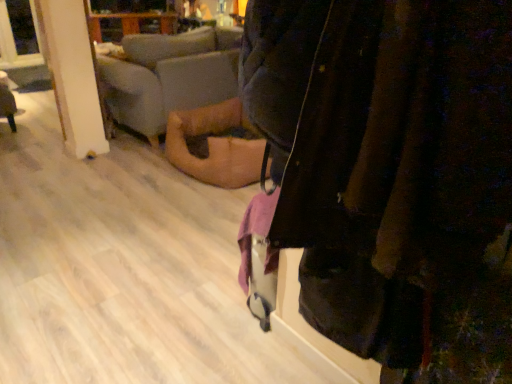
Describe the element at coordinates (169, 76) in the screenshot. I see `soft beige fabric couch at center` at that location.

Where is `velvet dark jacket at center`? Image resolution: width=512 pixels, height=384 pixels. velvet dark jacket at center is located at coordinates (393, 175).

Describe the element at coordinates (393, 175) in the screenshot. The height and width of the screenshot is (384, 512). I see `velvet dark jacket at center` at that location.

Locate an element on the screen. transparent glass window at upper left is located at coordinates (18, 32).

In the scene shown: Is transparent glass window at upper left facing towards soft beige fabric couch at center?

Yes.

Is point (21, 25) positioned before point (158, 61)?

No, it is not.

From a real-world perspective, is transparent glass window at upper left physically below soft beige fabric couch at center?

No, from a real-world perspective, transparent glass window at upper left is not below soft beige fabric couch at center.

From the image's perspective, which is above, transparent glass window at upper left or soft beige fabric couch at center?

From the image's view, transparent glass window at upper left is above.

Is transparent glass window at upper left taller than wooden floor at lower left?

Yes, transparent glass window at upper left is taller than wooden floor at lower left.

Can you tell me how much transparent glass window at upper left and wooden floor at lower left differ in facing direction?

The facing directions of transparent glass window at upper left and wooden floor at lower left are 87 degrees apart.

Which of these two, transparent glass window at upper left or wooden floor at lower left, is smaller?

With smaller size is wooden floor at lower left.

Which object is positioned more to the left, transparent glass window at upper left or wooden floor at lower left?

From the viewer's perspective, transparent glass window at upper left appears more on the left side.

The image size is (512, 384). I want to click on jacket above the wooden floor at lower left (from a real-world perspective), so click(x=393, y=175).

Measure the distance from wooden floor at lower left to velvet dark jacket at center.

wooden floor at lower left and velvet dark jacket at center are 13.56 feet apart from each other.

In terms of size, does wooden floor at lower left appear bigger or smaller than velvet dark jacket at center?

wooden floor at lower left is smaller than velvet dark jacket at center.

Which is correct: wooden floor at lower left is inside velvet dark jacket at center, or outside of it?

wooden floor at lower left is not inside velvet dark jacket at center, it's outside.

Is soft beige fabric couch at center spatially inside transparent glass window at upper left, or outside of it?

The correct answer is: outside.

Based on their sizes in the image, would you say soft beige fabric couch at center is bigger or smaller than transparent glass window at upper left?

Clearly, soft beige fabric couch at center is larger in size than transparent glass window at upper left.

Where is `window screen on the left of soft beige fabric couch at center`? window screen on the left of soft beige fabric couch at center is located at coordinates (18, 32).

From the image's perspective, is soft beige fabric couch at center beneath transparent glass window at upper left?

Yes, from the image's perspective, soft beige fabric couch at center is below transparent glass window at upper left.

Is point (21, 49) positioned behind point (505, 147)?

Yes.

Is transparent glass window at upper left aimed at velvet dark jacket at center?

Yes, transparent glass window at upper left is facing velvet dark jacket at center.

Is velvet dark jacket at center completely or partially inside transparent glass window at upper left?

No.

How different are the orientations of transparent glass window at upper left and velvet dark jacket at center in degrees?

90.1 degrees.

In the scene shown: Who is shorter, velvet dark jacket at center or transparent glass window at upper left?

Standing shorter between the two is velvet dark jacket at center.

From the image's perspective, who appears lower, velvet dark jacket at center or transparent glass window at upper left?

velvet dark jacket at center.

How many degrees apart are the facing directions of velvet dark jacket at center and transparent glass window at upper left?

There is a 90.1-degree angle between the facing directions of velvet dark jacket at center and transparent glass window at upper left.

Is point (316, 53) closer or farther from the camera than point (2, 9)?

Point (316, 53) is closer to the camera than point (2, 9).

From a real-world perspective, is soft beige fabric couch at center positioned above or below wooden floor at lower left?

Clearly, from a real-world perspective, soft beige fabric couch at center is above wooden floor at lower left.

Is soft beige fabric couch at center far from wooden floor at lower left?

Yes, soft beige fabric couch at center and wooden floor at lower left are located far from each other.

Is soft beige fabric couch at center situated inside wooden floor at lower left or outside?

soft beige fabric couch at center lies outside wooden floor at lower left.

From the image's perspective, is soft beige fabric couch at center under wooden floor at lower left?

Actually, soft beige fabric couch at center appears above wooden floor at lower left in the image.

The height and width of the screenshot is (384, 512). In the image, there is a soft beige fabric couch at center. Identify the location of window screen above it (from the image's perspective). (18, 32).

I want to click on window screen that is behind the wooden floor at lower left, so click(x=18, y=32).

Considering their positions, is wooden floor at lower left positioned closer to transparent glass window at upper left than soft beige fabric couch at center?

The object closer to transparent glass window at upper left is wooden floor at lower left.

Looking at the image, which one is located further to soft beige fabric couch at center, wooden floor at lower left or transparent glass window at upper left?

wooden floor at lower left.

Which object lies nearer to the anchor point transparent glass window at upper left, wooden floor at lower left or velvet dark jacket at center?

wooden floor at lower left is closer to transparent glass window at upper left.

Estimate the real-world distances between objects in this image. Which object is further from soft beige fabric couch at center, transparent glass window at upper left or wooden floor at lower left?

wooden floor at lower left is positioned further to the anchor soft beige fabric couch at center.

Looking at the image, which one is located further to soft beige fabric couch at center, wooden floor at lower left or velvet dark jacket at center?

velvet dark jacket at center.

Looking at the image, which one is located closer to wooden floor at lower left, velvet dark jacket at center or soft beige fabric couch at center?

The object closer to wooden floor at lower left is soft beige fabric couch at center.

From the image, which object appears to be nearer to transparent glass window at upper left, velvet dark jacket at center or soft beige fabric couch at center?

soft beige fabric couch at center lies closer to transparent glass window at upper left than the other object.

Which object lies further to the anchor point wooden floor at lower left, soft beige fabric couch at center or transparent glass window at upper left?

Based on the image, soft beige fabric couch at center appears to be further to wooden floor at lower left.

Where is `studio couch between velvet dark jacket at center and wooden floor at lower left in the front-back direction`? The height and width of the screenshot is (384, 512). studio couch between velvet dark jacket at center and wooden floor at lower left in the front-back direction is located at coordinates (169, 76).

Image resolution: width=512 pixels, height=384 pixels. I want to click on furniture between transparent glass window at upper left and soft beige fabric couch at center from left to right, so click(7, 102).

Find the location of a particular element. This screenshot has width=512, height=384. studio couch positioned between velvet dark jacket at center and transparent glass window at upper left from near to far is located at coordinates [169, 76].

The height and width of the screenshot is (384, 512). I want to click on furniture between velvet dark jacket at center and transparent glass window at upper left from front to back, so click(x=7, y=102).